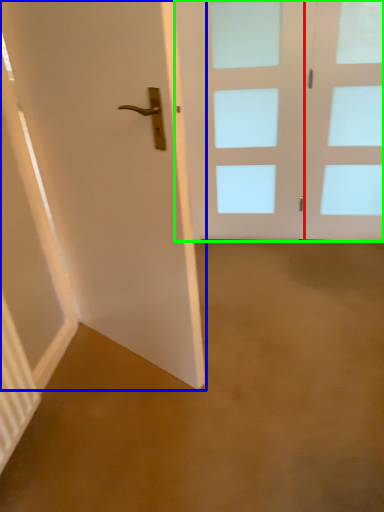
Question: Which object is the farthest from glass door (highlighted by a red box)? Choose among these: door (highlighted by a blue box) or door (highlighted by a green box).

Choices:
 (A) door
 (B) door

Answer: (A)